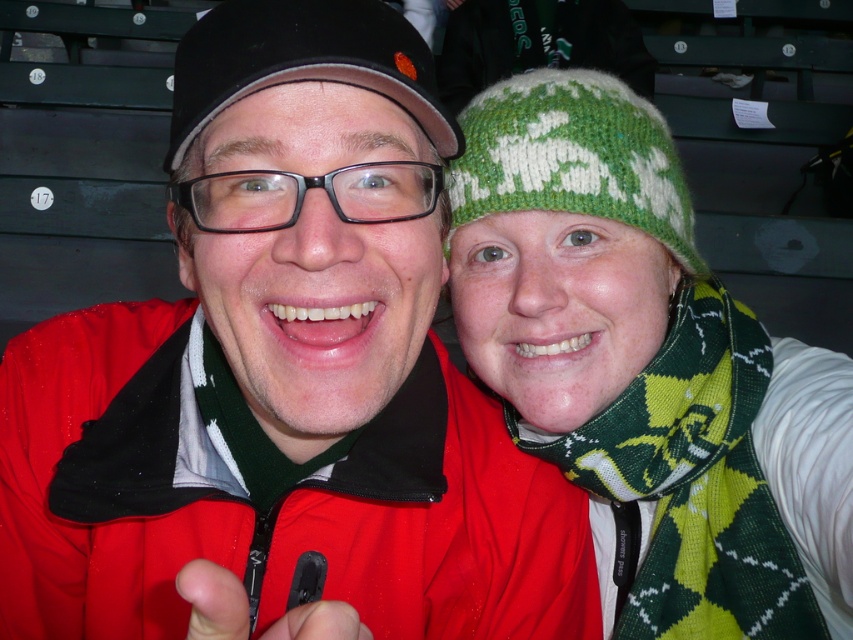
Which of these two, matte black jacket at center or black matte cap at upper center, stands taller?

matte black jacket at center

Is matte black jacket at center behind black matte cap at upper center?

No, it is not.

What are the coordinates of `matte black jacket at center` in the screenshot? It's located at (283, 376).

Identify the location of matte black jacket at center. (283, 376).

Does point (473, 131) lie in front of point (454, 156)?

No.

You are a GUI agent. You are given a task and a screenshot of the screen. Output one action in this format:
    pyautogui.click(x=<x>, y=<y>)
    Task: Click on the green knitted hat at upper right
    
    Given the screenshot: What is the action you would take?
    pyautogui.click(x=573, y=156)

Is point (583, 445) positioned after point (320, 26)?

That is True.

Does green knitted scarf at right have a larger size compared to black matte cap at upper center?

Yes.

Where is `green knitted scarf at right`? green knitted scarf at right is located at coordinates (693, 483).

I want to click on green knitted scarf at right, so click(693, 483).